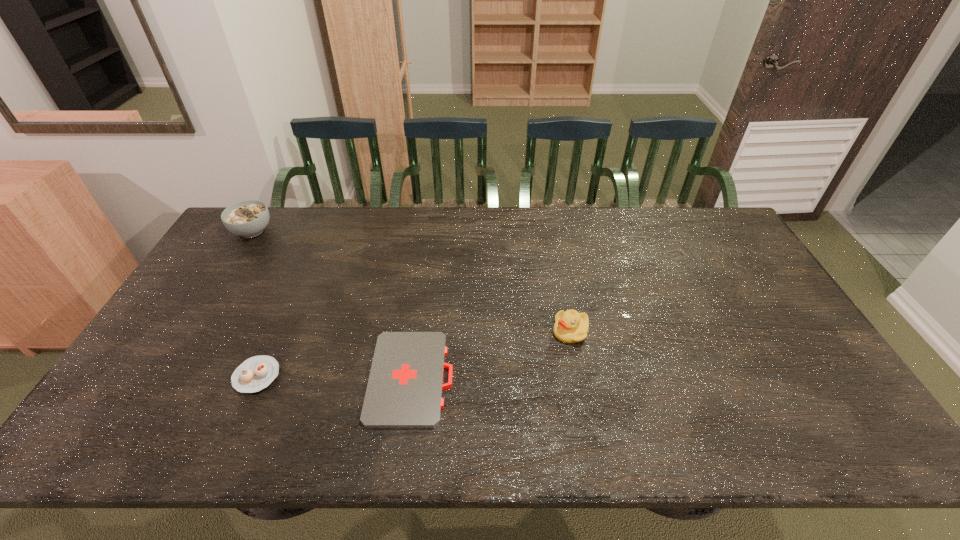
This screenshot has width=960, height=540. I want to click on free space between the rightmost object and the leftmost object, so click(x=411, y=281).

Where is `vacant area that lies between the second shortest object and the first-aid kit`? This screenshot has width=960, height=540. vacant area that lies between the second shortest object and the first-aid kit is located at coordinates (334, 377).

Identify which object is located as the third nearest to the duckling. Please provide its 2D coordinates. Your answer should be formatted as a tuple, i.e. [(x, y)], where the tuple contains the x and y coordinates of a point satisfying the conditions above.

[(248, 218)]

At what (x,y) coordinates should I click in order to perform the action: click on object that is the second closest one to the second object from left to right. Please return your answer as a coordinate pair (x, y). Looking at the image, I should click on (248, 218).